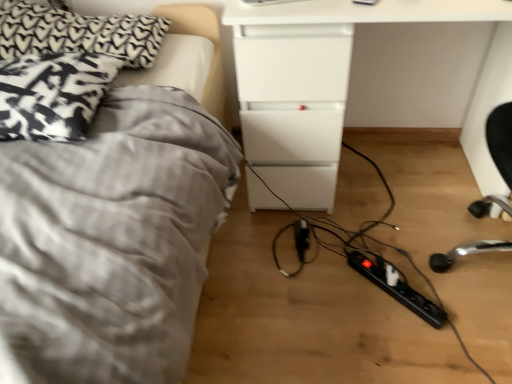
Question: Visually, is patterned fabric pillow at left, marked as the 2th pillow in a top-to-bottom arrangement, positioned to the left or to the right of gray fabric bed at left?

Choices:
 (A) left
 (B) right

Answer: (A)

Question: Is patterned fabric pillow at left, marked as the 1th pillow in a bottom-to-top arrangement, inside or outside of gray fabric bed at left?

Choices:
 (A) outside
 (B) inside

Answer: (B)

Question: Estimate the real-world distances between objects in this image. Which object is farther from the black plastic extension cord at center, the second extension cord viewed from the front?

Choices:
 (A) black textured pillow at upper left, the second pillow positioned from the bottom
 (B) patterned fabric pillow at left, marked as the 1th pillow in a bottom-to-top arrangement
 (C) black plastic extension cord at lower right, placed as the second extension cord when sorted from left to right
 (D) gray fabric bed at left
 (E) white glossy drawer at center

Answer: (A)

Question: Based on their relative distances, which object is nearer to the white glossy drawer at center?

Choices:
 (A) black plastic extension cord at lower right, placed as the second extension cord when sorted from left to right
 (B) black plastic extension cord at center, acting as the 1th extension cord starting from the left
 (C) gray fabric bed at left
 (D) patterned fabric pillow at left, marked as the 1th pillow in a bottom-to-top arrangement
 (E) black textured pillow at upper left, which is the first pillow from top to bottom

Answer: (B)